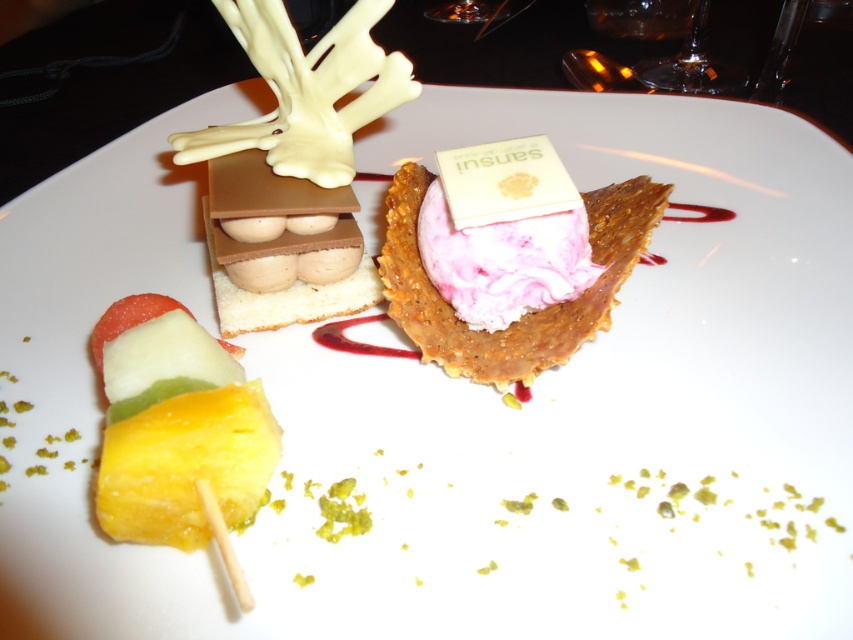
You are a food critic standing at a distance of 30 inches from the dessert plate. You notice a point labeled as point (178,461). Can you reach this point with your finger without moving closer to the plate?

The point (178,461) is 31.34 inches from the viewer. Since you are standing 30 inches away, you cannot reach it without moving closer.

You are a food critic observing the dessert plate. Which object is positioned in front of the other between the multicolored fruit skewer at center and the pink creamy ice cream at center?

The multicolored fruit skewer at center is closer to the viewer than the pink creamy ice cream at center, so the fruit skewer is in front of the ice cream.

You are a food critic analyzing the dessert plate. The multicolored fruit skewer at center is placed at a specific coordinate. Can you determine if it is positioned to the left or right of the center point of the plate?

The multicolored fruit skewer at center is located at point 0.667 on the x axis, which is to the right of the center point of the plate. Therefore, it is positioned to the right of the plate center.